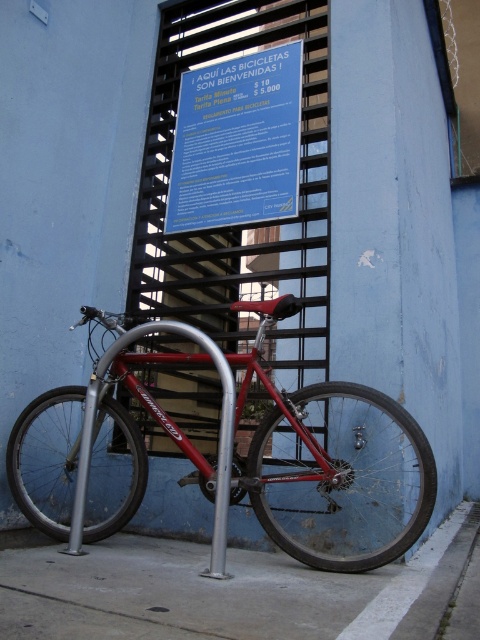
Looking at this image, is shiny red bicycle at center to the left of blue paper sign at upper center from the viewer's perspective?

Correct, you'll find shiny red bicycle at center to the left of blue paper sign at upper center.

Which is behind, point (279, 461) or point (264, 51)?

The point (264, 51) is behind.

In order to click on shiny red bicycle at center in this screenshot , I will do `click(334, 467)`.

Who is more distant from viewer, (180, 120) or (96, 403)?

Positioned behind is point (180, 120).

Can you confirm if blue paper sign at upper center is shorter than silver metallic pole at center?

No, blue paper sign at upper center is not shorter than silver metallic pole at center.

Which is in front, point (264, 83) or point (76, 536)?

Point (76, 536) is in front.

The height and width of the screenshot is (640, 480). Find the location of `blue paper sign at upper center`. blue paper sign at upper center is located at coordinates (237, 141).

Can you confirm if gray concrete pavement at lower center is shorter than blue paper sign at upper center?

Correct, gray concrete pavement at lower center is not as tall as blue paper sign at upper center.

Is point (448, 557) closer to viewer compared to point (278, 168)?

That is True.

Describe the element at coordinates (238, 593) in the screenshot. I see `gray concrete pavement at lower center` at that location.

This screenshot has width=480, height=640. I want to click on gray concrete pavement at lower center, so click(238, 593).